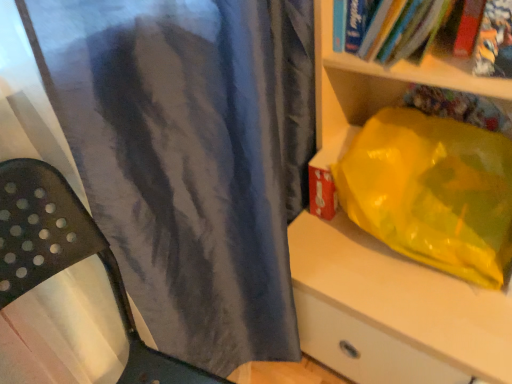
Question: Is hardcover book at upper right, the 2th book in the left-to-right sequence, looking in the opposite direction of matte plastic bag at right?

Choices:
 (A) yes
 (B) no

Answer: (A)

Question: Does hardcover book at upper right, the 2th book in the left-to-right sequence, have a greater height compared to matte plastic bag at right?

Choices:
 (A) yes
 (B) no

Answer: (B)

Question: From the image's perspective, is hardcover book at upper right, the 2th book in the left-to-right sequence, under matte plastic bag at right?

Choices:
 (A) yes
 (B) no

Answer: (B)

Question: Is hardcover book at upper right, the 2th book in the left-to-right sequence, not close to matte plastic bag at right?

Choices:
 (A) yes
 (B) no

Answer: (B)

Question: Is hardcover book at upper right, which is the first book in right-to-left order, outside matte plastic bag at right?

Choices:
 (A) yes
 (B) no

Answer: (B)

Question: Would you say matte gray curtain at center is to the left or to the right of matte plastic bag at right in the picture?

Choices:
 (A) right
 (B) left

Answer: (B)

Question: From the image's perspective, is matte gray curtain at center positioned above or below matte plastic bag at right?

Choices:
 (A) above
 (B) below

Answer: (B)

Question: Considering their positions, is matte gray curtain at center located in front of or behind matte plastic bag at right?

Choices:
 (A) behind
 (B) front

Answer: (B)

Question: Is matte gray curtain at center bigger or smaller than matte plastic bag at right?

Choices:
 (A) big
 (B) small

Answer: (B)

Question: Is hardcover book at upper right, positioned as the 2th book in right-to-left order, wider or thinner than matte gray curtain at center?

Choices:
 (A) wide
 (B) thin

Answer: (B)

Question: Is point (486, 18) closer or farther from the camera than point (96, 148)?

Choices:
 (A) farther
 (B) closer

Answer: (A)

Question: Do you think hardcover book at upper right, the first book viewed from the left, is within matte gray curtain at center, or outside of it?

Choices:
 (A) outside
 (B) inside

Answer: (A)

Question: Considering the positions of hardcover book at upper right, the first book viewed from the left, and matte gray curtain at center in the image, is hardcover book at upper right, the first book viewed from the left, taller or shorter than matte gray curtain at center?

Choices:
 (A) tall
 (B) short

Answer: (B)

Question: Do you think hardcover book at upper right, the 2th book in the left-to-right sequence, is within hardcover book at upper right, positioned as the 2th book in right-to-left order, or outside of it?

Choices:
 (A) inside
 (B) outside

Answer: (A)

Question: From the image's perspective, is hardcover book at upper right, the 2th book in the left-to-right sequence, above or below hardcover book at upper right, the first book viewed from the left?

Choices:
 (A) below
 (B) above

Answer: (A)